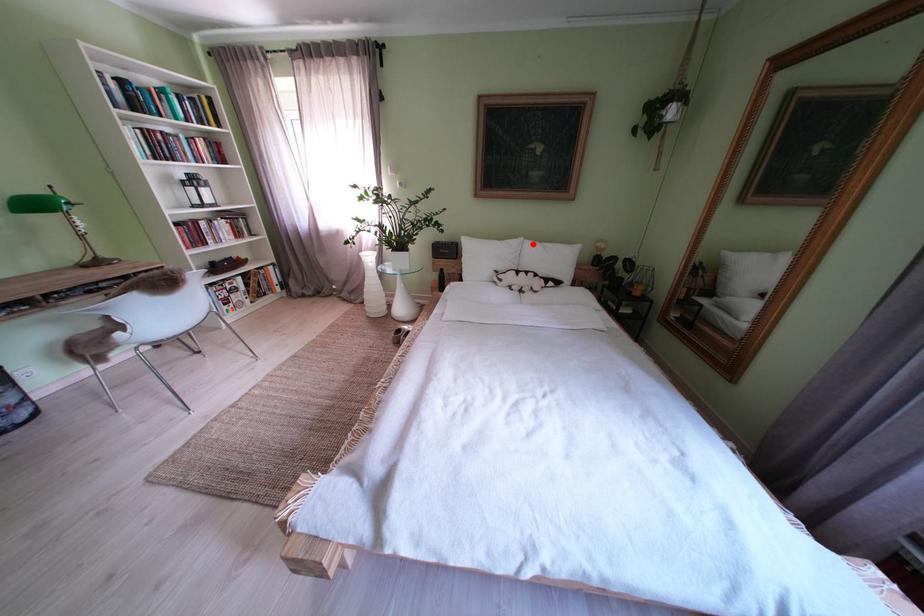
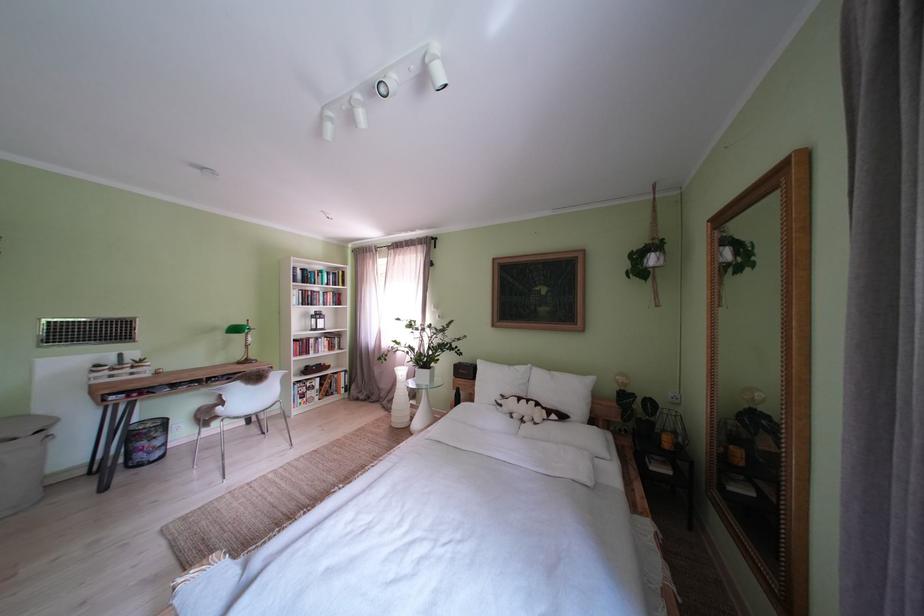
In the second image, find the point that corresponds to the highlighted location in the first image.

(541, 371)